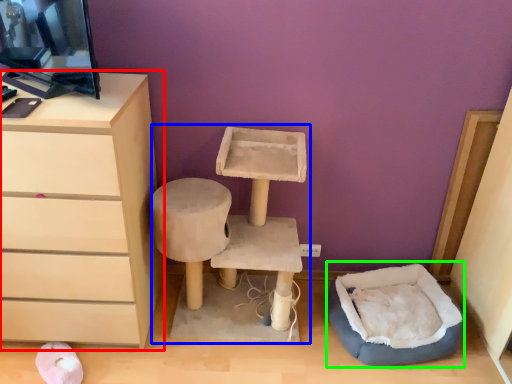
Question: Estimate the real-world distances between objects in this image. Which object is closer to chest of drawers (highlighted by a red box), vanity (highlighted by a blue box) or bean bag chair (highlighted by a green box)?

Choices:
 (A) vanity
 (B) bean bag chair

Answer: (A)